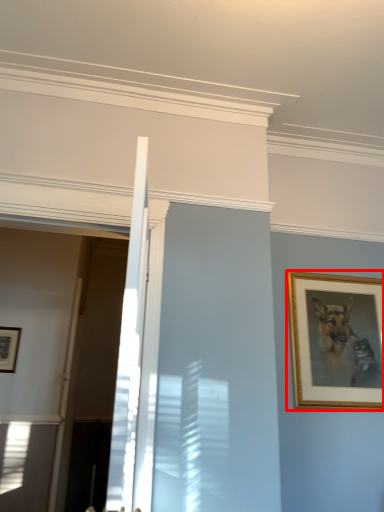
Question: From the image's perspective, what is the correct spatial relationship of picture frame (annotated by the red box) in relation to picture frame?

Choices:
 (A) below
 (B) above

Answer: (B)